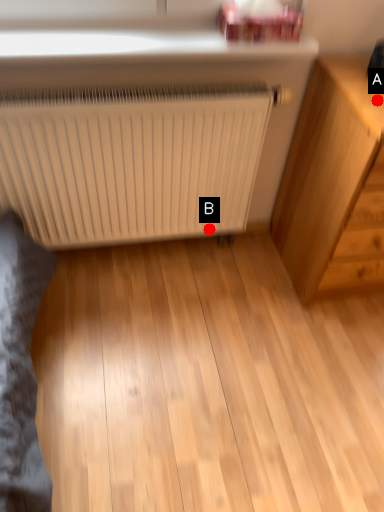
Question: Two points are circled on the image, labeled by A and B beside each circle. Which point is farther from the camera taking this photo?

Choices:
 (A) A is further
 (B) B is further

Answer: (B)